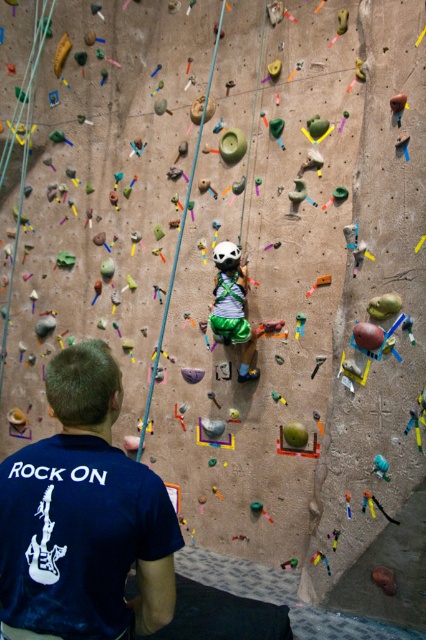
Between dark blue t-shirt at lower left and white matte helmet at center, which one is positioned lower?

dark blue t-shirt at lower left is below.

Which is in front, point (120, 625) or point (244, 291)?

Point (120, 625)

The height and width of the screenshot is (640, 426). Identify the location of dark blue t-shirt at lower left. (83, 516).

You are a GUI agent. You are given a task and a screenshot of the screen. Output one action in this format:
    pyautogui.click(x=<x>, y=<y>)
    Task: Click on the dark blue t-shirt at lower left
    The height and width of the screenshot is (640, 426).
    Given the screenshot: What is the action you would take?
    pyautogui.click(x=83, y=516)